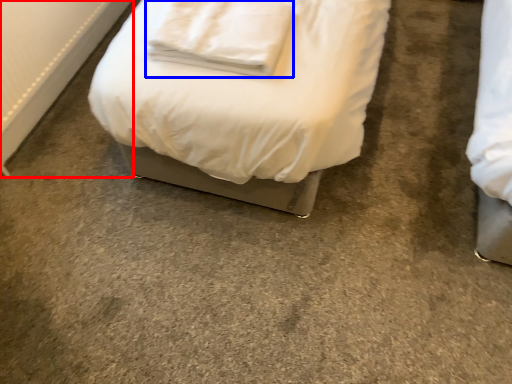
Question: Which object is closer to the camera taking this photo, radiator (highlighted by a red box) or pillow (highlighted by a blue box)?

Choices:
 (A) radiator
 (B) pillow

Answer: (B)